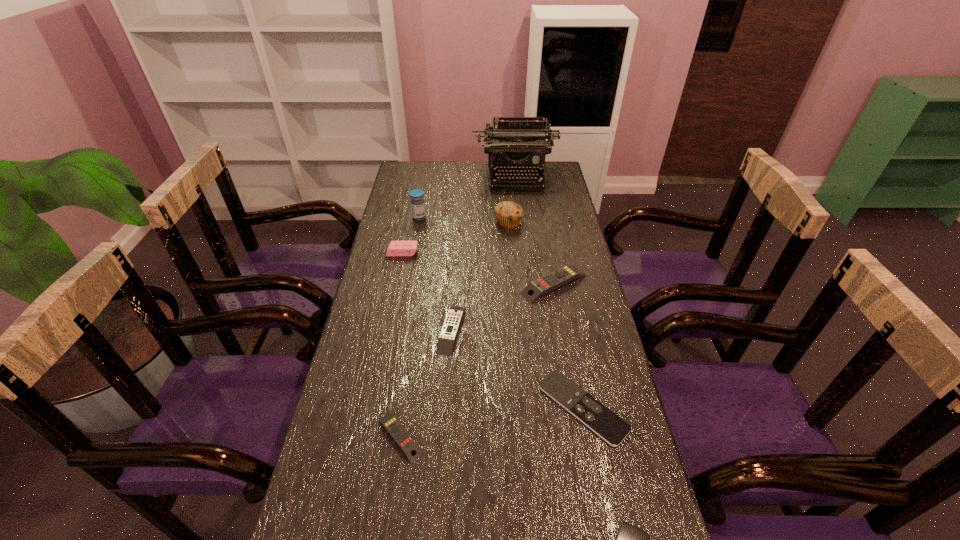
Select which remote control appears as the closest to the fourth remote control from right to left. Please provide its 2D coordinates. Your answer should be formatted as a tuple, i.e. [(x, y)], where the tuple contains the x and y coordinates of a point satisfying the conditions above.

[(534, 290)]

I want to click on the third closest remote control relative to the second tallest object, so click(610, 427).

Identify which yellow remote control is the third nearest to the muffin. Please provide its 2D coordinates. Your answer should be formatted as a tuple, i.e. [(x, y)], where the tuple contains the x and y coordinates of a point satisfying the conditions above.

[(402, 438)]

Identify the location of yellow remote control that can be found as the closest to the leftmost remote control. The height and width of the screenshot is (540, 960). (450, 328).

Locate which black remote control is the second closest to the smallest yellow remote control. Please provide its 2D coordinates. Your answer should be formatted as a tuple, i.e. [(x, y)], where the tuple contains the x and y coordinates of a point satisfying the conditions above.

[(630, 539)]

Where is `free space that satisfies the following two spatial constraints: 1. on the front side of the smallest yellow remote control; 2. on the right side of the medicine`? This screenshot has width=960, height=540. free space that satisfies the following two spatial constraints: 1. on the front side of the smallest yellow remote control; 2. on the right side of the medicine is located at coordinates (380, 437).